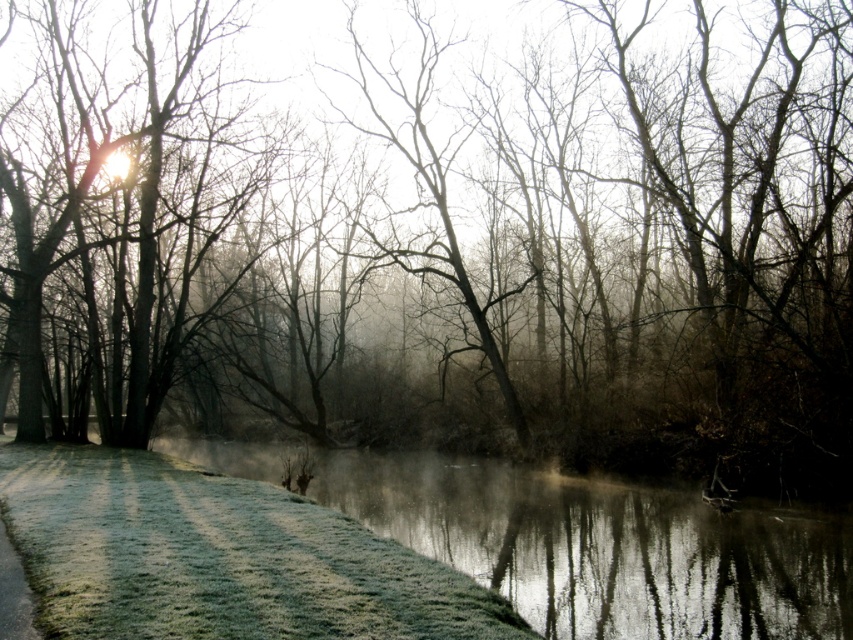
Question: Which object appears farthest from the camera in this image?

Choices:
 (A) frosted glass river at lower center
 (B) green frosty grass at lower left

Answer: (A)

Question: From the image, what is the correct spatial relationship of frosted glass river at lower center in relation to green frosty grass at lower left?

Choices:
 (A) right
 (B) left

Answer: (A)

Question: Considering the relative positions of frosted glass river at lower center and green frosty grass at lower left in the image provided, where is frosted glass river at lower center located with respect to green frosty grass at lower left?

Choices:
 (A) above
 (B) below

Answer: (B)

Question: Which point is farther from the camera taking this photo?

Choices:
 (A) (143, 618)
 (B) (358, 451)

Answer: (B)

Question: Can you confirm if frosted glass river at lower center is positioned above green frosty grass at lower left?

Choices:
 (A) no
 (B) yes

Answer: (A)